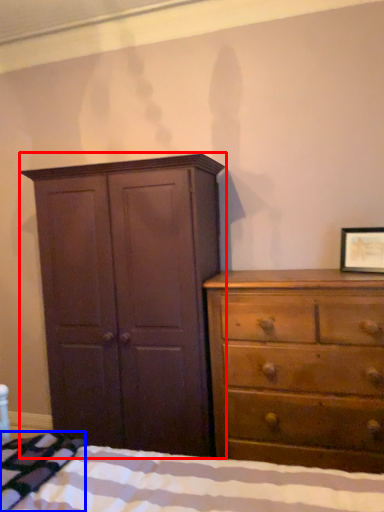
Question: Which object appears closest to the camera in this image, cupboard (highlighted by a red box) or blanket (highlighted by a blue box)?

Choices:
 (A) cupboard
 (B) blanket

Answer: (B)